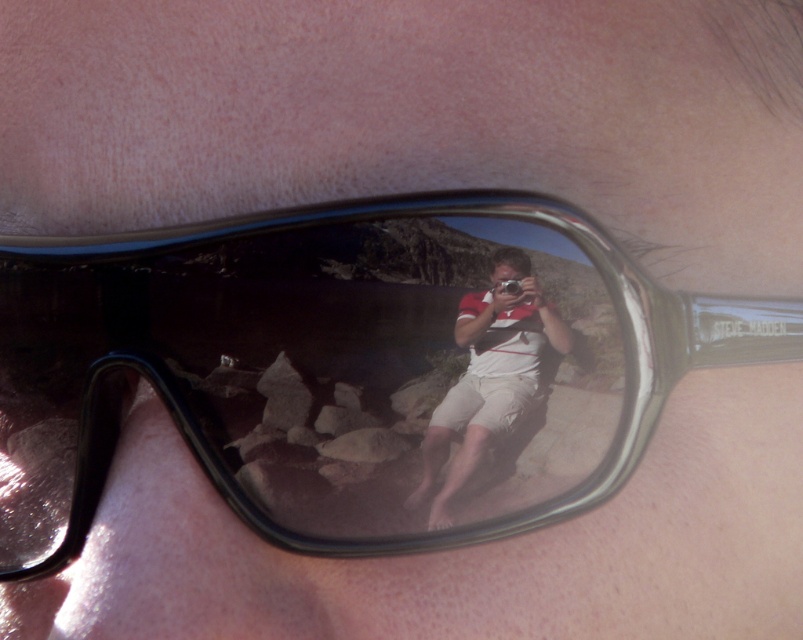
Question: Is black plastic goggles at center thinner than matte white shorts at center?

Choices:
 (A) yes
 (B) no

Answer: (B)

Question: In this image, where is black plastic goggles at center located relative to matte white shorts at center?

Choices:
 (A) left
 (B) right

Answer: (A)

Question: Is black plastic goggles at center positioned before matte white shorts at center?

Choices:
 (A) no
 (B) yes

Answer: (B)

Question: Which point is farther to the camera?

Choices:
 (A) matte white shorts at center
 (B) black plastic goggles at center

Answer: (A)